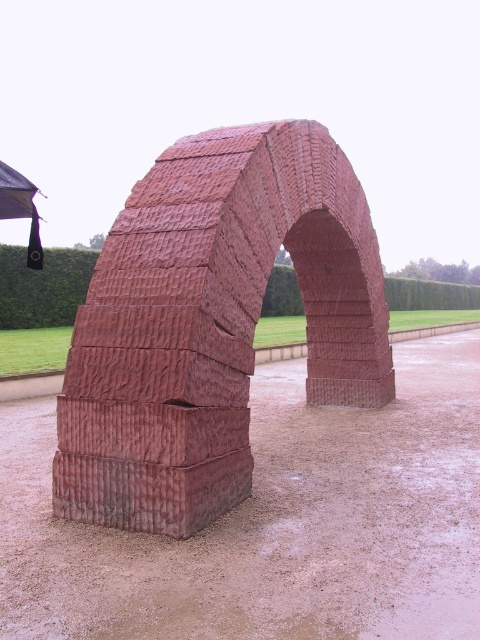
Question: Which point appears farthest from the camera in this image?

Choices:
 (A) (98, 420)
 (B) (24, 184)

Answer: (B)

Question: Which point is farther to the camera?

Choices:
 (A) rustic stone arch at center
 (B) black fabric umbrella at upper left

Answer: (B)

Question: Which of the following is the farthest from the observer?

Choices:
 (A) (202, 355)
 (B) (3, 166)

Answer: (B)

Question: Is rustic stone arch at center smaller than black fabric umbrella at upper left?

Choices:
 (A) yes
 (B) no

Answer: (A)

Question: Does rustic stone arch at center appear under black fabric umbrella at upper left?

Choices:
 (A) yes
 (B) no

Answer: (A)

Question: Can you confirm if rustic stone arch at center is positioned below black fabric umbrella at upper left?

Choices:
 (A) no
 (B) yes

Answer: (B)